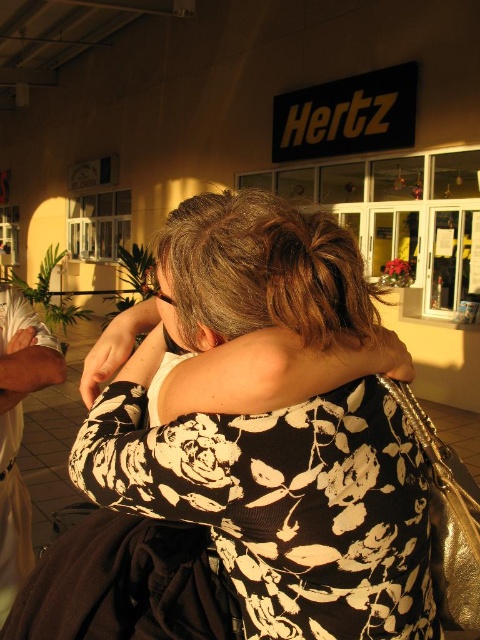
Can you confirm if black floral dress at center is positioned to the right of white fabric at left?

Yes, black floral dress at center is to the right of white fabric at left.

In the scene shown: Does black floral dress at center have a greater width compared to white fabric at left?

Yes, black floral dress at center is wider than white fabric at left.

Does point (288, 552) come in front of point (7, 428)?

That is True.

The image size is (480, 640). Identify the location of black floral dress at center. (274, 435).